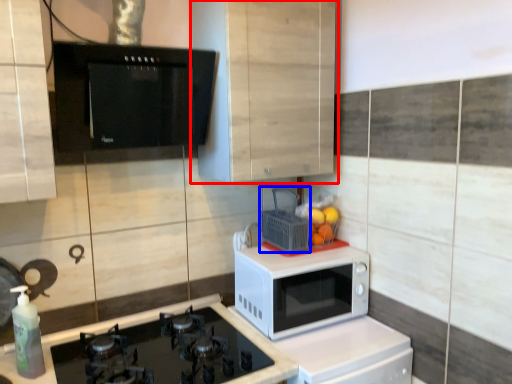
Question: Which point is further to the camera, cabinetry (highlighted by a red box) or basket (highlighted by a blue box)?

Choices:
 (A) cabinetry
 (B) basket

Answer: (B)